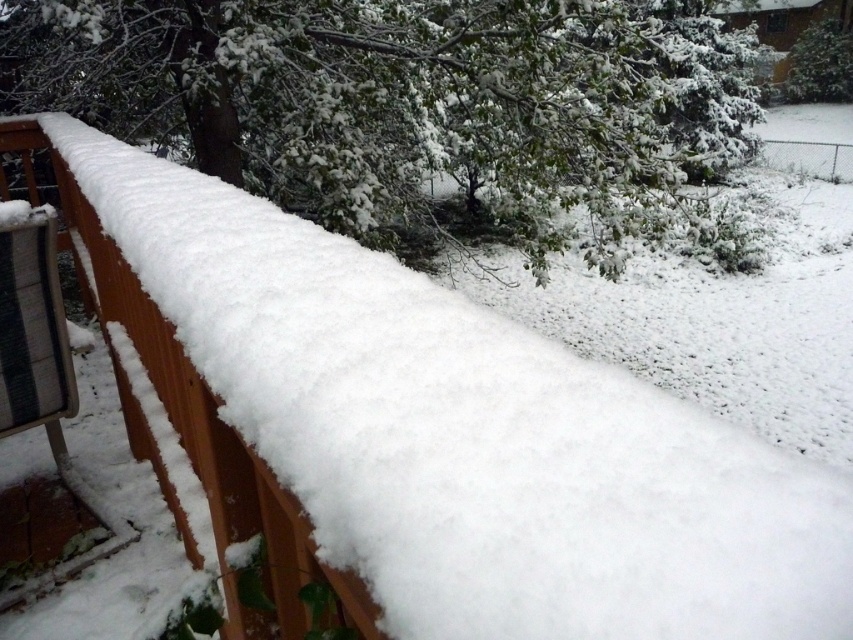
Based on the photo, is white snow-covered tree at upper center further to camera compared to green matte tree at upper right?

No, white snow-covered tree at upper center is in front of green matte tree at upper right.

Measure the distance between white snow-covered tree at upper center and camera.

They are 14.78 feet apart.

Locate an element on the screen. This screenshot has width=853, height=640. white snow-covered tree at upper center is located at coordinates (407, 100).